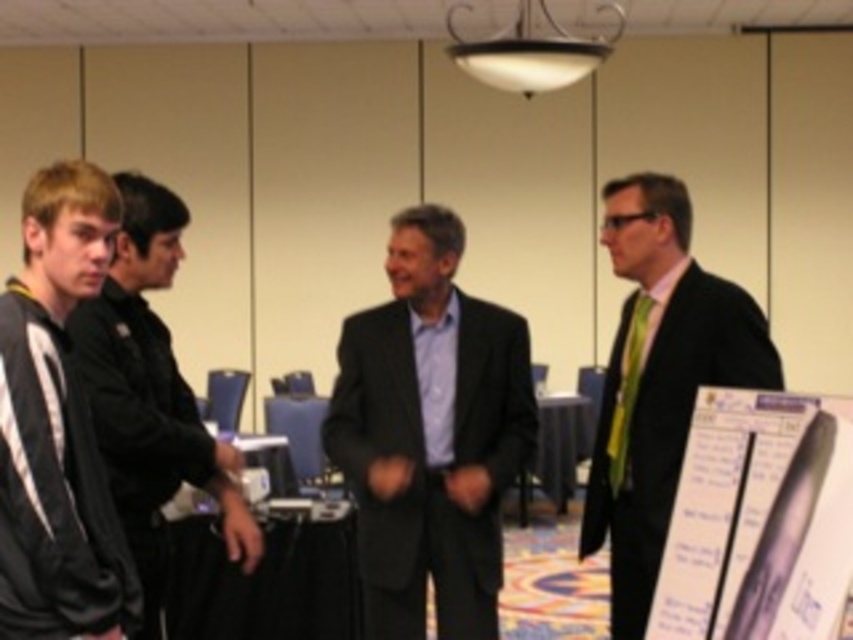
You are standing in the conference room and want to greet both the matte black suit at right and the black jacket at left. Which one should you approach first if you want to greet the person closer to you?

You should approach the matte black suit at right first because it is closer to you than the black jacket at left, which is further away.